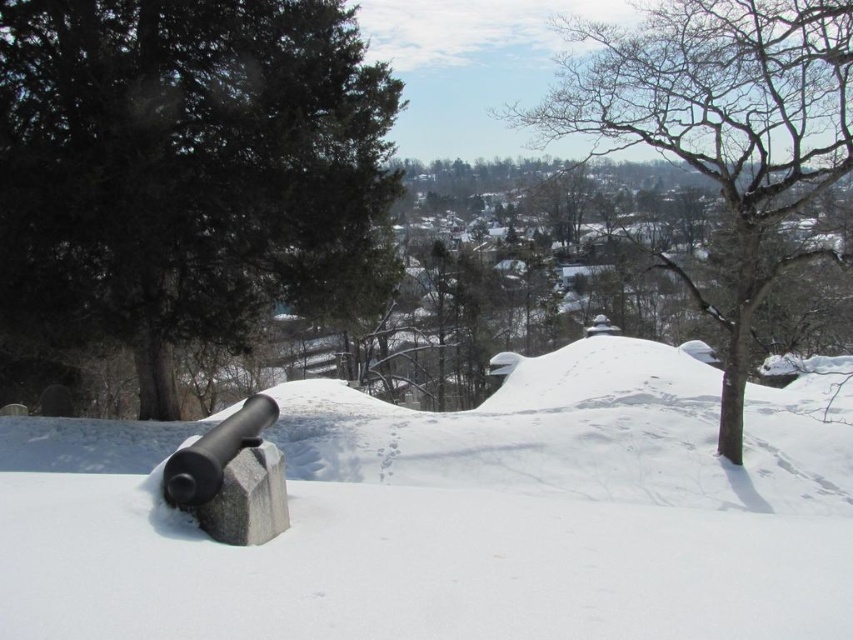
Question: Considering the real-world distances, which object is closest to the bare wood tree at upper right?

Choices:
 (A) gray stone cannon at lower left
 (B) dark green textured tree at upper left
 (C) white matte snow at center

Answer: (C)

Question: Does white matte snow at center have a larger size compared to dark green textured tree at upper left?

Choices:
 (A) no
 (B) yes

Answer: (B)

Question: Is dark green textured tree at upper left closer to camera compared to gray stone cannon at lower left?

Choices:
 (A) yes
 (B) no

Answer: (B)

Question: Which point is farther from the camera taking this photo?

Choices:
 (A) (173, 513)
 (B) (308, 132)
 (C) (262, 461)

Answer: (B)

Question: Considering the relative positions of white matte snow at center and bare wood tree at upper right in the image provided, where is white matte snow at center located with respect to bare wood tree at upper right?

Choices:
 (A) right
 (B) left

Answer: (B)

Question: Which object is closer to the camera taking this photo?

Choices:
 (A) gray stone cannon at lower left
 (B) dark green textured tree at upper left

Answer: (A)